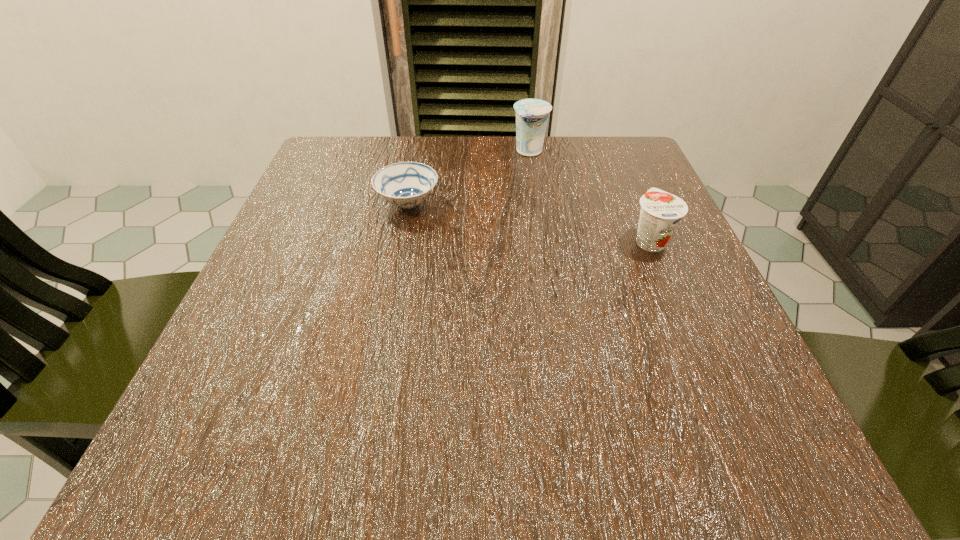
Where is `the second closest object to the second shortest object`? Image resolution: width=960 pixels, height=540 pixels. the second closest object to the second shortest object is located at coordinates (406, 184).

Where is `free space that satisfies the following two spatial constraints: 1. on the front side of the second shortest object; 2. on the right side of the farthest object`? free space that satisfies the following two spatial constraints: 1. on the front side of the second shortest object; 2. on the right side of the farthest object is located at coordinates (543, 240).

The height and width of the screenshot is (540, 960). Identify the location of free spot that satisfies the following two spatial constraints: 1. on the front side of the shortest object; 2. on the right side of the nearer yogurt. (401, 240).

Find the location of a particular element. free spot that satisfies the following two spatial constraints: 1. on the back side of the taller yogurt; 2. on the right side of the leftmost object is located at coordinates (419, 151).

At what (x,y) coordinates should I click in order to perform the action: click on vacant space that satisfies the following two spatial constraints: 1. on the front side of the right yogurt; 2. on the left side of the soup bowl. Please return your answer as a coordinate pair (x, y). Looking at the image, I should click on (401, 240).